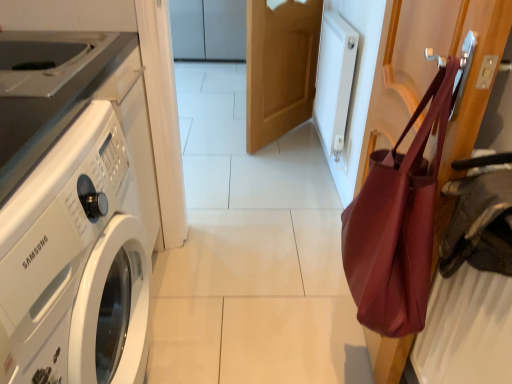
Where is `matte burgundy tote bag at right`? The image size is (512, 384). matte burgundy tote bag at right is located at coordinates (397, 223).

The height and width of the screenshot is (384, 512). Find the location of `washing machine that is in front of the matte burgundy tote bag at right`. washing machine that is in front of the matte burgundy tote bag at right is located at coordinates (76, 263).

From the image's perspective, is matte burgundy tote bag at right beneath white glossy washing machine at left?

No, from the image's perspective, matte burgundy tote bag at right is not below white glossy washing machine at left.

Does matte burgundy tote bag at right have a lesser width compared to white glossy washing machine at left?

Correct, the width of matte burgundy tote bag at right is less than that of white glossy washing machine at left.

Is matte burgundy tote bag at right touching white glossy washing machine at left?

No, matte burgundy tote bag at right is not beside white glossy washing machine at left.

Between white glossy washing machine at left and light brown wood door at center, which one is positioned behind?

light brown wood door at center is behind.

From a real-world perspective, which object stands above the other?

light brown wood door at center.

Are white glossy washing machine at left and light brown wood door at center beside each other?

There is a gap between white glossy washing machine at left and light brown wood door at center.

Between white glossy washing machine at left and light brown wood door at center, which one appears on the right side from the viewer's perspective?

Positioned to the right is light brown wood door at center.

How far apart are white glossy washing machine at left and matte burgundy tote bag at right?

white glossy washing machine at left is 22.26 inches from matte burgundy tote bag at right.

Based on the photo, is white glossy washing machine at left in contact with matte burgundy tote bag at right?

No, white glossy washing machine at left is not touching matte burgundy tote bag at right.

Does white glossy washing machine at left have a lesser height compared to matte burgundy tote bag at right?

No, white glossy washing machine at left is not shorter than matte burgundy tote bag at right.

Does point (7, 275) come in front of point (365, 311)?

Yes, it is.

From a real-world perspective, which object stands above the other?

light brown wood door at center.

Would you say light brown wood door at center contains white glossy washing machine at left?

That's incorrect, white glossy washing machine at left is not inside light brown wood door at center.

Looking at this image, can you tell me how much light brown wood door at center and white glossy washing machine at left differ in facing direction?

146 degrees.

Looking at this image, does light brown wood door at center appear on the right side of white glossy washing machine at left?

Yes.

Considering the relative positions of matte burgundy tote bag at right and light brown wood door at center in the image provided, is matte burgundy tote bag at right to the right of light brown wood door at center from the viewer's perspective?

Indeed, matte burgundy tote bag at right is positioned on the right side of light brown wood door at center.

Does point (362, 273) come farther from viewer compared to point (266, 21)?

No.

Find the location of a particular element. tote bag that is above the light brown wood door at center (from a real-world perspective) is located at coordinates (397, 223).

Which of these two, matte burgundy tote bag at right or light brown wood door at center, is bigger?

Bigger between the two is light brown wood door at center.

Is light brown wood door at center not close to matte burgundy tote bag at right?

light brown wood door at center is far away from matte burgundy tote bag at right.

Is light brown wood door at center aimed at matte burgundy tote bag at right?

No, light brown wood door at center is not turned towards matte burgundy tote bag at right.

Looking at this image, relative to matte burgundy tote bag at right, is light brown wood door at center in front or behind?

light brown wood door at center is positioned farther from the viewer than matte burgundy tote bag at right.

Considering the sizes of objects light brown wood door at center and matte burgundy tote bag at right in the image provided, who is bigger, light brown wood door at center or matte burgundy tote bag at right?

Bigger between the two is light brown wood door at center.

Locate an element on the screen. The height and width of the screenshot is (384, 512). tote bag that appears on the right of white glossy washing machine at left is located at coordinates (397, 223).

Identify the location of washing machine that is below the light brown wood door at center (from the image's perspective). (76, 263).

Based on their spatial positions, is light brown wood door at center or matte burgundy tote bag at right closer to white glossy washing machine at left?

Among the two, matte burgundy tote bag at right is located nearer to white glossy washing machine at left.

Which object lies further to the anchor point matte burgundy tote bag at right, white glossy washing machine at left or light brown wood door at center?

The object further to matte burgundy tote bag at right is light brown wood door at center.

From the image, which object appears to be farther from white glossy washing machine at left, matte burgundy tote bag at right or light brown wood door at center?

Based on the image, light brown wood door at center appears to be further to white glossy washing machine at left.

From the picture: Estimate the real-world distances between objects in this image. Which object is closer to light brown wood door at center, matte burgundy tote bag at right or white glossy washing machine at left?

matte burgundy tote bag at right is closer to light brown wood door at center.

Which object lies nearer to the anchor point matte burgundy tote bag at right, light brown wood door at center or white glossy washing machine at left?

white glossy washing machine at left.

Based on their spatial positions, is white glossy washing machine at left or matte burgundy tote bag at right closer to light brown wood door at center?

matte burgundy tote bag at right lies closer to light brown wood door at center than the other object.

Where is `tote bag between white glossy washing machine at left and light brown wood door at center in the front-back direction`? tote bag between white glossy washing machine at left and light brown wood door at center in the front-back direction is located at coordinates (397, 223).